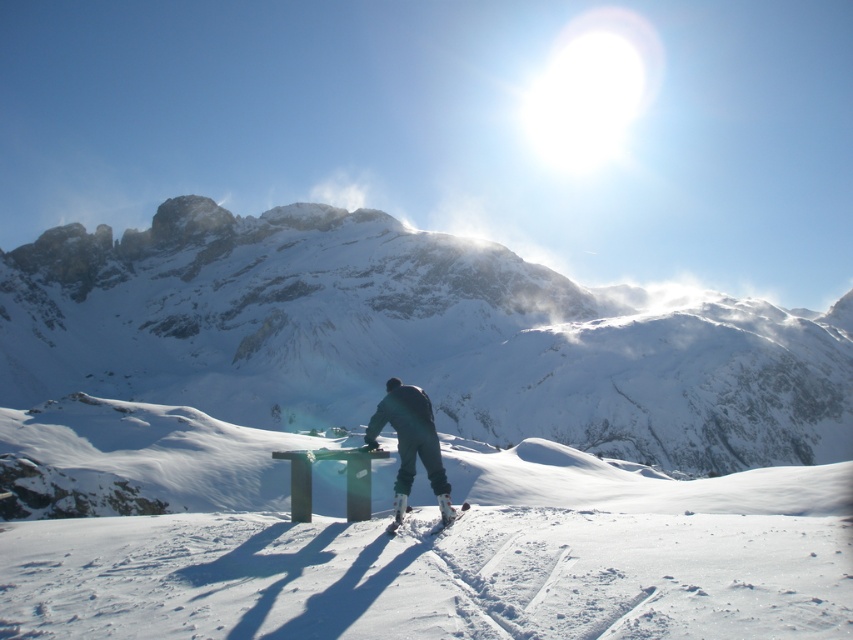
Based on the photo, you are a photographer trying to capture a photo of the snowy rock mountain at center and the dark blue snow pants at center. Which object should you focus on first to ensure both are in sharp focus?

You should focus on the dark blue snow pants at center first because it is closer to you than the snowy rock mountain at center, ensuring both will be in focus when using proper depth of field.

From the picture: You are a photographer planning to take a wide shot of the snowy rock mountain at center and the dark blue snow pants at center in the winter scene. Based on their sizes, which object will occupy more space in the photo?

The snowy rock mountain at center will occupy more space in the photo because its width is larger than that of the dark blue snow pants at center.